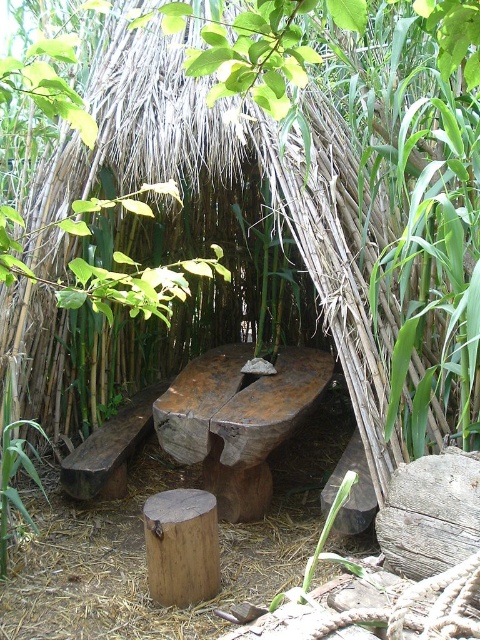
You are planning to place a new small potted plant between the green leafy plant at lower left and the green leafy plant at lower center. Which of the two existing plants should you place it closer to if you want the new plant to have more space to grow upwards?

You should place the new small potted plant closer to the green leafy plant at lower left since it is much taller than the green leafy plant at lower center, allowing more vertical space for growth.

Based on the photo, you are standing at the entrance of the rustic bamboo structure and want to place a small decorative item exactly at the center of the table. Given the coordinates provided, is the green leafy plant at lower left located closer to the center of the table or the edge?

The green leafy plant at lower left is located at coordinates point (13, 472), which places it closer to the edge of the table rather than the center.